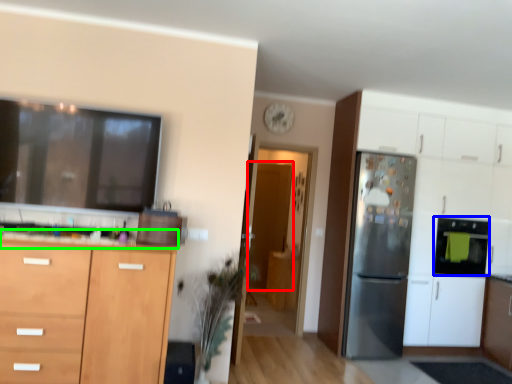
Question: Which object is the farthest from glass door (highlighted by a red box)? Choose among these: appliance (highlighted by a blue box) or countertop (highlighted by a green box).

Choices:
 (A) appliance
 (B) countertop

Answer: (B)